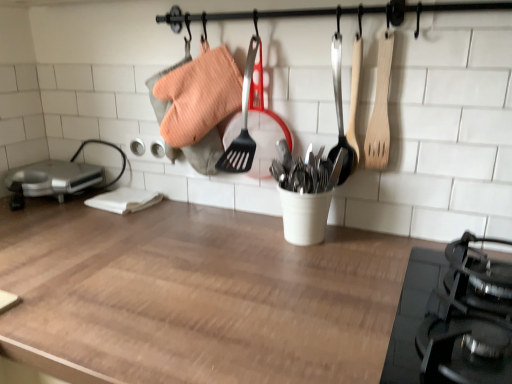
Question: From the image's perspective, is metallic silver appliance at left located above or below wooden at center?

Choices:
 (A) below
 (B) above

Answer: (B)

Question: Is metallic silver appliance at left inside the boundaries of wooden at center, or outside?

Choices:
 (A) outside
 (B) inside

Answer: (A)

Question: Which object is positioned farthest from the metallic silver appliance at left?

Choices:
 (A) wooden spoon at upper right
 (B) wooden at center
 (C) wooden spatula at upper right

Answer: (C)

Question: Estimate the real-world distances between objects in this image. Which object is farther from the metallic silver appliance at left?

Choices:
 (A) wooden at center
 (B) wooden spatula at upper right
 (C) wooden spoon at upper right

Answer: (B)